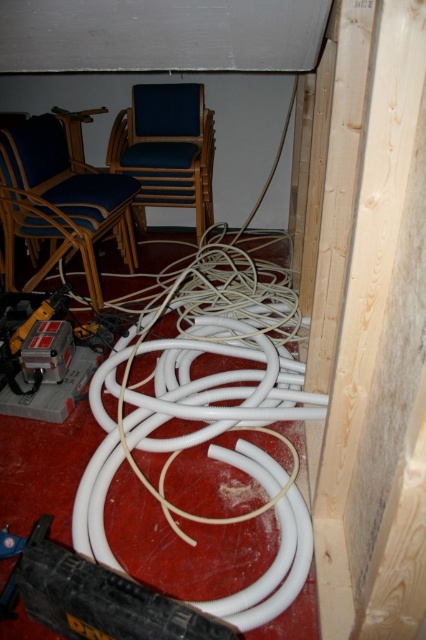
Between matte blue wood chair at upper left and blue fabric chair at center, which one has less height?

Standing shorter between the two is blue fabric chair at center.

Can you confirm if matte blue wood chair at upper left is wider than blue fabric chair at center?

Correct, the width of matte blue wood chair at upper left exceeds that of blue fabric chair at center.

Measure the distance between point (43, 134) and camera.

Point (43, 134) is 2.60 meters from camera.

At what (x,y) coordinates should I click in order to perform the action: click on matte blue wood chair at upper left. Please return your answer as a coordinate pair (x, y). Looking at the image, I should click on (60, 200).

Is point (91, 246) in front of point (13, 355)?

No, (91, 246) is further to viewer.

Does matte blue wood chair at upper left have a lesser width compared to yellow plastic drill at lower left?

Incorrect, matte blue wood chair at upper left's width is not less than yellow plastic drill at lower left's.

Locate an element on the screen. matte blue wood chair at upper left is located at coordinates (60, 200).

The width and height of the screenshot is (426, 640). I want to click on matte blue wood chair at upper left, so click(60, 200).

Is blue fabric chair at center closer to camera compared to yellow plastic drill at lower left?

No, it is behind yellow plastic drill at lower left.

Does blue fabric chair at center have a larger size compared to yellow plastic drill at lower left?

Yes, blue fabric chair at center is bigger than yellow plastic drill at lower left.

Is point (184, 173) less distant than point (23, 323)?

No, (184, 173) is further to viewer.

Identify the location of blue fabric chair at center. (166, 148).